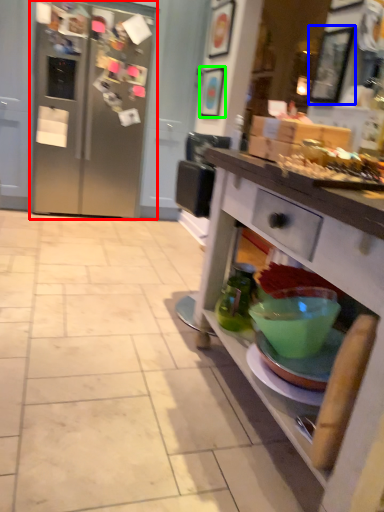
Question: Based on their relative distances, which object is farther from refrigerator (highlighted by a red box)? Choose from picture frame (highlighted by a blue box) and picture frame (highlighted by a green box).

Choices:
 (A) picture frame
 (B) picture frame

Answer: (A)